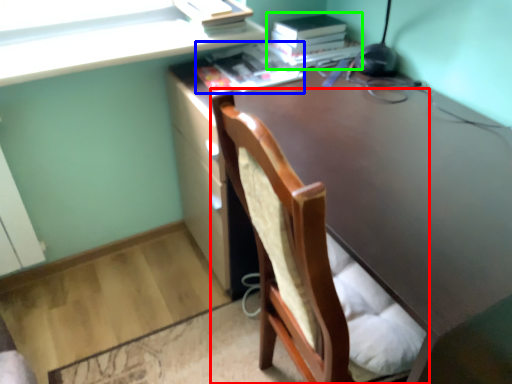
Question: Estimate the real-world distances between objects in this image. Which object is farther from chair (highlighted by a red box), book (highlighted by a blue box) or paperback book (highlighted by a green box)?

Choices:
 (A) book
 (B) paperback book

Answer: (B)